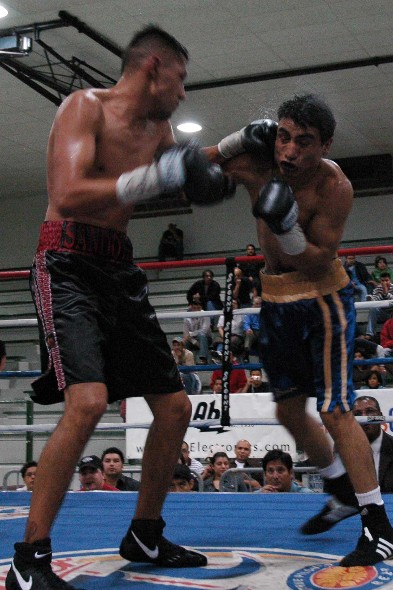
The image size is (393, 590). In order to click on light in this screenshot , I will do `click(3, 9)`, `click(187, 124)`.